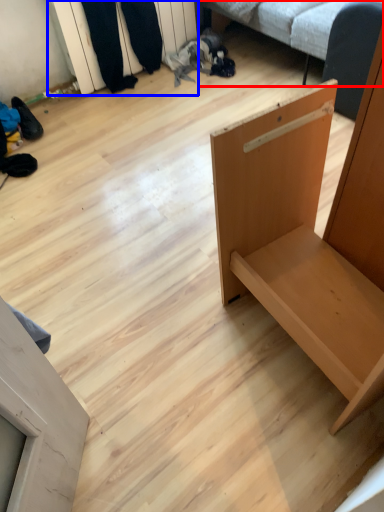
Question: Which point is closer to the camera, studio couch (highlighted by a red box) or shelf (highlighted by a blue box)?

Choices:
 (A) studio couch
 (B) shelf

Answer: (A)